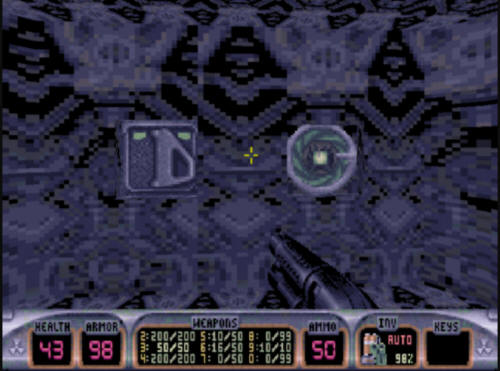
Locate an element on the screen. The height and width of the screenshot is (371, 500). keys is located at coordinates (442, 323).